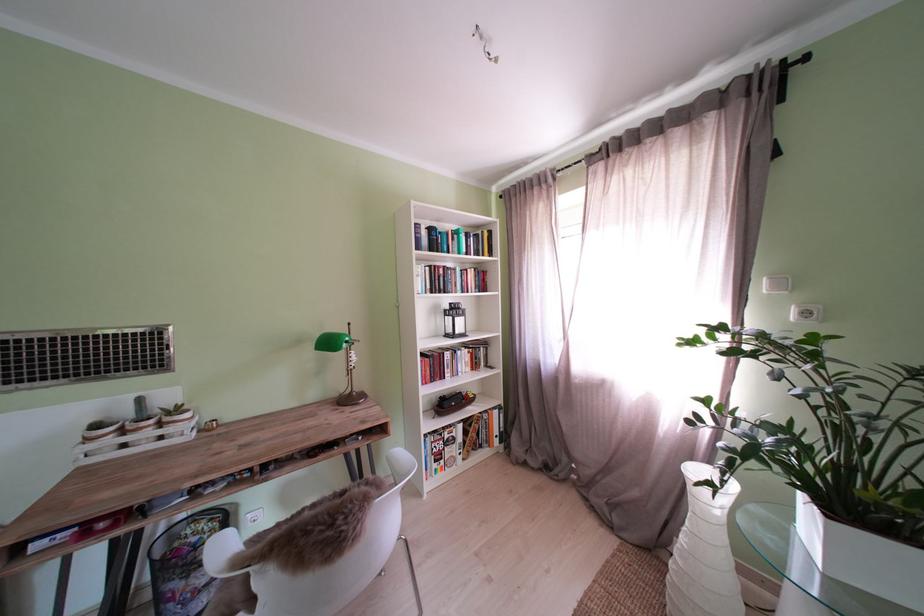
In order to click on white light switch in this screenshot , I will do `click(806, 313)`.